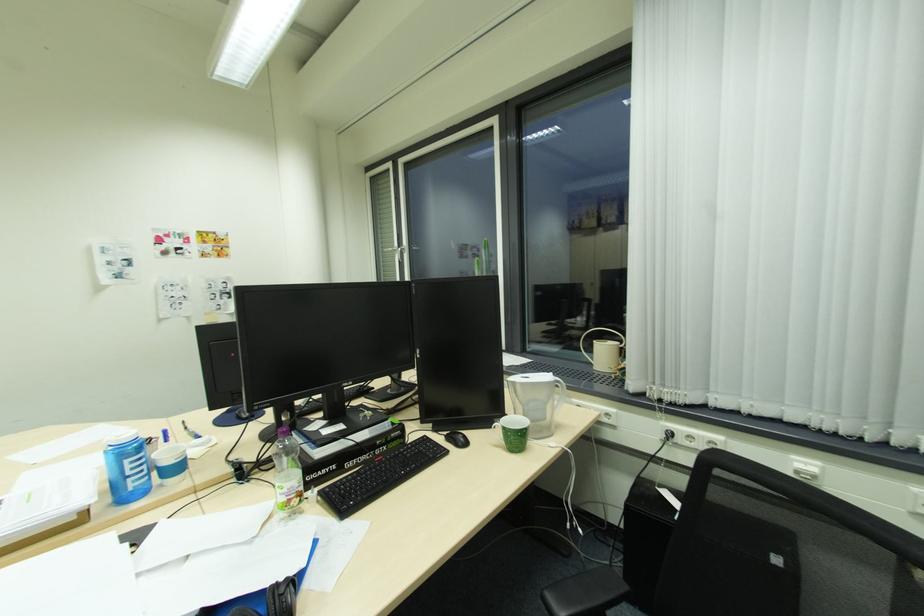
Locate an element on the screen. purple bottle cap is located at coordinates (283, 431).